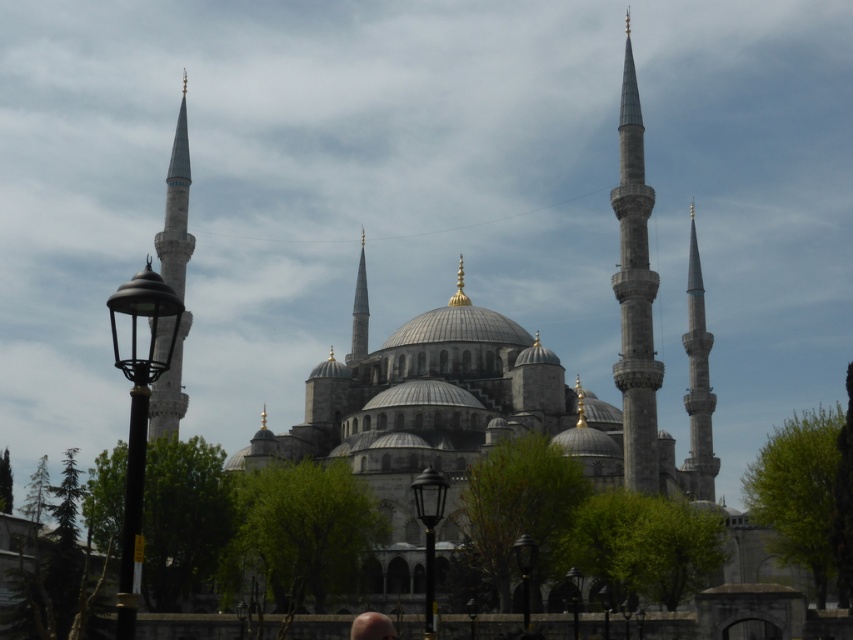
You are standing in front of the mosque and want to take a photo that includes both the gray stone spire at right and the smooth stone minaret at center. Based on their positions, which one should you position to the left in your camera frame?

The smooth stone minaret at center is to the left of the gray stone spire at right, so you should position the smooth stone minaret at center to the left in your camera frame.

You are standing in front of the grand mosque and want to take a photo of the smooth stone minaret at center. According to the image coordinates, where should you aim your camera to capture the minaret accurately?

You should aim your camera at the coordinates point (358, 310) to capture the smooth stone minaret at center accurately.

You are standing in front of the grand mosque and notice two objects in the scene. One is the smooth stone minaret at center and the other is the smooth skin head at lower center. From your vantage point, which object is positioned higher?

The smooth stone minaret at center is above the smooth skin head at lower center, so the smooth stone minaret at center is positioned higher.